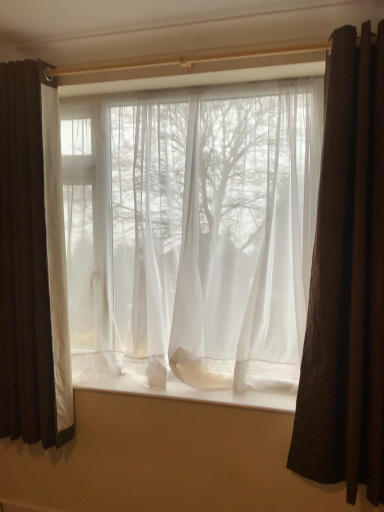
Question: Looking at the image, does white sheer fabric at center seem bigger or smaller compared to sheer white curtain at center, which ranks as the 2th curtain in left-to-right order?

Choices:
 (A) big
 (B) small

Answer: (B)

Question: In terms of width, does white sheer fabric at center look wider or thinner when compared to sheer white curtain at center, which ranks as the 2th curtain in left-to-right order?

Choices:
 (A) thin
 (B) wide

Answer: (B)

Question: Estimate the real-world distances between objects in this image. Which object is farther from the matte white curtain at left, positioned as the first curtain in left-to-right order?

Choices:
 (A) sheer white curtain at center, placed as the second curtain when sorted from right to left
 (B) white sheer fabric at center
 (C) brown velvet curtain at right, positioned as the third curtain in left-to-right order

Answer: (C)

Question: Based on their relative distances, which object is nearer to the sheer white curtain at center, which ranks as the 2th curtain in left-to-right order?

Choices:
 (A) white sheer fabric at center
 (B) brown velvet curtain at right, positioned as the third curtain in left-to-right order
 (C) matte white curtain at left, positioned as the first curtain in left-to-right order

Answer: (C)